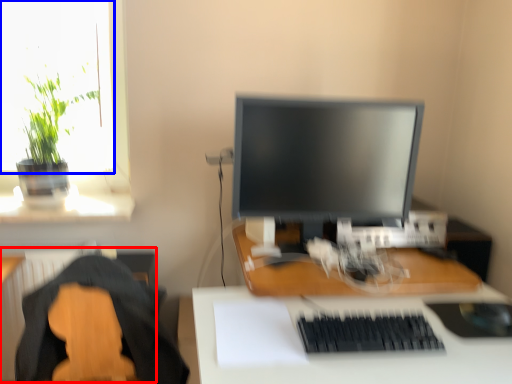
Question: Which point is further to the camera, radiator (highlighted by a red box) or window screen (highlighted by a blue box)?

Choices:
 (A) radiator
 (B) window screen

Answer: (B)